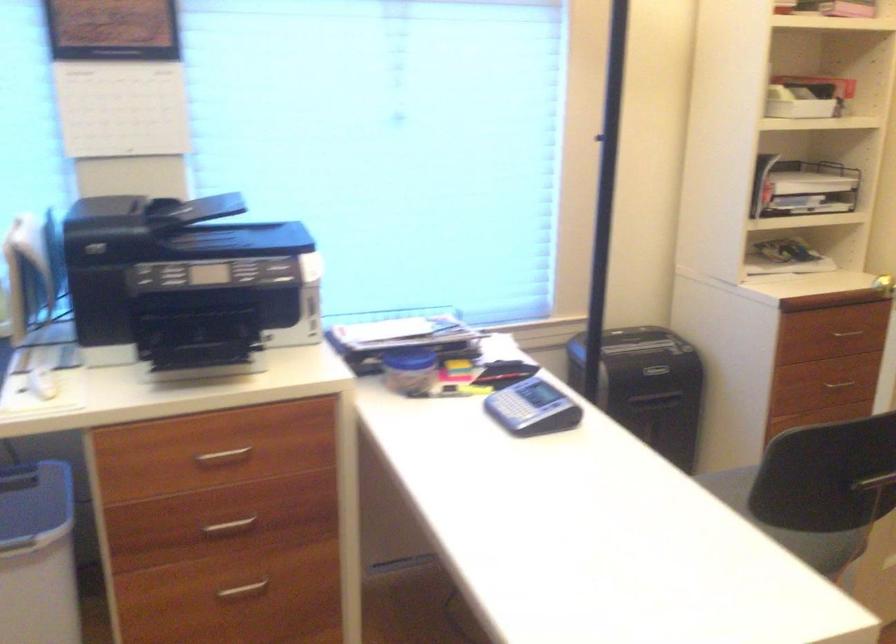
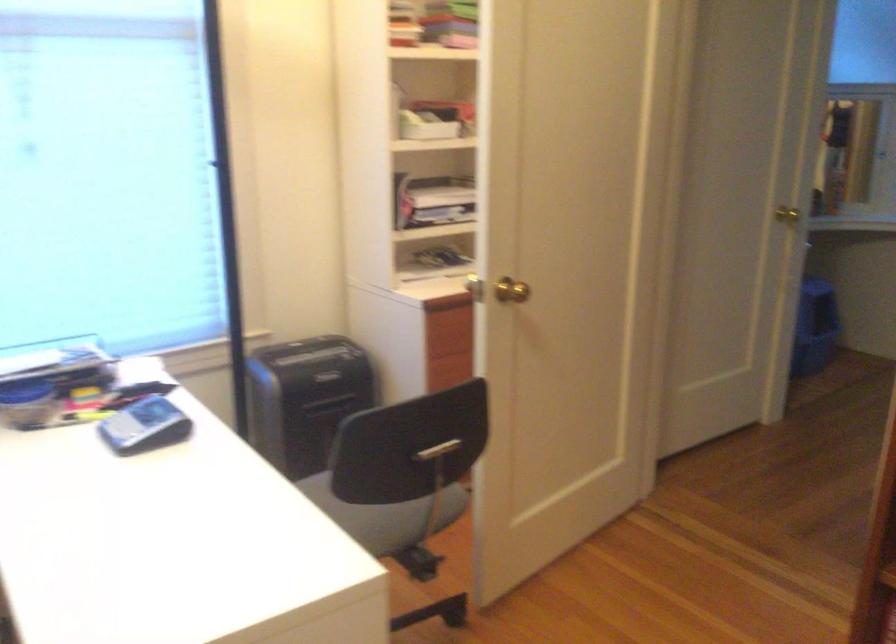
Question: I am providing you with two images of the same scene from different viewpoints. After the viewpoint changes to image2, which objects are now occluded?

Choices:
 (A) chair sitting surface
 (B) drawer handle
 (C) orange plastic strainer
 (D) grey calculator

Answer: (B)